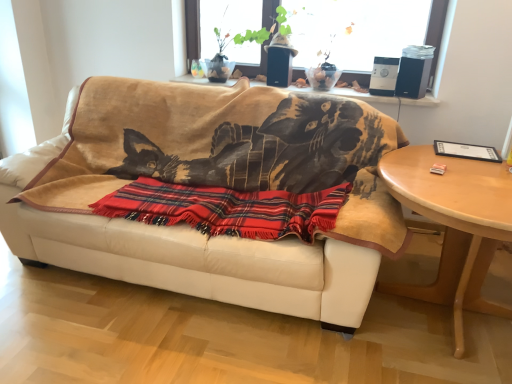
What is the approximate height of white leather couch at center?

The height of white leather couch at center is 1.03 meters.

This screenshot has height=384, width=512. What do you see at coordinates (454, 224) in the screenshot?
I see `light wood/finished table at right` at bounding box center [454, 224].

The image size is (512, 384). I want to click on white leather couch at center, so click(x=209, y=184).

Based on the photo, from the image's perspective, is plaid fabric blanket at center over white leather couch at center?

No.

Considering the sizes of objects plaid fabric blanket at center and white leather couch at center in the image provided, who is smaller, plaid fabric blanket at center or white leather couch at center?

plaid fabric blanket at center is smaller.

Which point is more forward, (97, 204) or (176, 155)?

The point (97, 204) is closer.

Are plaid fabric blanket at center and white leather couch at center far apart?

No, plaid fabric blanket at center is not far away from white leather couch at center.

Is transparent glass window at upper center smaller than light wood/finished table at right?

Yes.

Can you tell me how much transparent glass window at upper center and light wood/finished table at right differ in facing direction?

They differ by 0.979 degrees in their facing directions.

Is transparent glass window at upper center further to the viewer compared to light wood/finished table at right?

Yes, transparent glass window at upper center is further from the viewer.

Who is shorter, transparent glass window at upper center or light wood/finished table at right?

transparent glass window at upper center.

Consider the image. Which object is closer to the camera, transparent glass window at upper center or white leather couch at center?

white leather couch at center is more forward.

Visually, is transparent glass window at upper center positioned to the left or to the right of white leather couch at center?

From the image, it's evident that transparent glass window at upper center is to the right of white leather couch at center.

From the image's perspective, which one is positioned higher, transparent glass window at upper center or white leather couch at center?

transparent glass window at upper center.

Where is `studio couch lying above the light wood/finished table at right (from the image's perspective)`? studio couch lying above the light wood/finished table at right (from the image's perspective) is located at coordinates (209, 184).

From the image's perspective, is light wood/finished table at right beneath white leather couch at center?

Indeed, from the image's perspective, light wood/finished table at right is shown beneath white leather couch at center.

From a real-world perspective, who is located lower, light wood/finished table at right or white leather couch at center?

light wood/finished table at right.

Where is `table below the white leather couch at center (from a real-world perspective)`? table below the white leather couch at center (from a real-world perspective) is located at coordinates (454, 224).

Could you tell me if white leather couch at center is turned towards light wood/finished table at right?

No, white leather couch at center is not aimed at light wood/finished table at right.

Does white leather couch at center contain light wood/finished table at right?

No.

Considering the positions of objects white leather couch at center and light wood/finished table at right in the image provided, who is in front, white leather couch at center or light wood/finished table at right?

light wood/finished table at right is more forward.

From the image's perspective, is light wood/finished table at right located above or below transparent glass window at upper center?

light wood/finished table at right is below transparent glass window at upper center.

Is light wood/finished table at right wider or thinner than transparent glass window at upper center?

light wood/finished table at right is wider than transparent glass window at upper center.

Measure the distance between light wood/finished table at right and transparent glass window at upper center.

light wood/finished table at right is 2.04 meters from transparent glass window at upper center.

Does light wood/finished table at right turn towards transparent glass window at upper center?

No, light wood/finished table at right is not facing towards transparent glass window at upper center.

Is light wood/finished table at right not within plaid fabric blanket at center?

light wood/finished table at right lies outside plaid fabric blanket at center's area.

How different are the orientations of light wood/finished table at right and plaid fabric blanket at center in degrees?

The angle between the facing direction of light wood/finished table at right and the facing direction of plaid fabric blanket at center is 1.21 degrees.

Can you confirm if light wood/finished table at right is smaller than plaid fabric blanket at center?

Actually, light wood/finished table at right might be larger than plaid fabric blanket at center.

Image resolution: width=512 pixels, height=384 pixels. I want to click on studio couch on the left of plaid fabric blanket at center, so click(x=209, y=184).

The width and height of the screenshot is (512, 384). In order to click on table below the transparent glass window at upper center (from a real-world perspective) in this screenshot , I will do `click(454, 224)`.

Estimate the real-world distances between objects in this image. Which object is further from transparent glass window at upper center, plaid fabric blanket at center or light wood/finished table at right?

light wood/finished table at right is further to transparent glass window at upper center.

Estimate the real-world distances between objects in this image. Which object is further from plaid fabric blanket at center, light wood/finished table at right or transparent glass window at upper center?

The object further to plaid fabric blanket at center is transparent glass window at upper center.

From the image, which object appears to be farther from white leather couch at center, plaid fabric blanket at center or light wood/finished table at right?

Based on the image, light wood/finished table at right appears to be further to white leather couch at center.

Consider the image. Based on their spatial positions, is light wood/finished table at right or white leather couch at center closer to plaid fabric blanket at center?

white leather couch at center is closer to plaid fabric blanket at center.

Looking at the image, which one is located closer to transparent glass window at upper center, light wood/finished table at right or plaid fabric blanket at center?

Based on the image, plaid fabric blanket at center appears to be nearer to transparent glass window at upper center.

Estimate the real-world distances between objects in this image. Which object is closer to light wood/finished table at right, white leather couch at center or plaid fabric blanket at center?

Based on the image, plaid fabric blanket at center appears to be nearer to light wood/finished table at right.

Based on their spatial positions, is white leather couch at center or plaid fabric blanket at center closer to transparent glass window at upper center?

Based on the image, white leather couch at center appears to be nearer to transparent glass window at upper center.

When comparing their distances from transparent glass window at upper center, does white leather couch at center or light wood/finished table at right seem further?

light wood/finished table at right.

Find the location of a particular element. blanket that lies between transparent glass window at upper center and light wood/finished table at right from top to bottom is located at coordinates (226, 209).

Where is `blanket located between white leather couch at center and light wood/finished table at right in the left-right direction`? blanket located between white leather couch at center and light wood/finished table at right in the left-right direction is located at coordinates (226, 209).

In order to click on window between white leather couch at center and light wood/finished table at right in the horizontal direction in this screenshot , I will do `click(192, 30)`.

The height and width of the screenshot is (384, 512). In order to click on studio couch between transparent glass window at upper center and plaid fabric blanket at center in the up-down direction in this screenshot , I will do `click(209, 184)`.